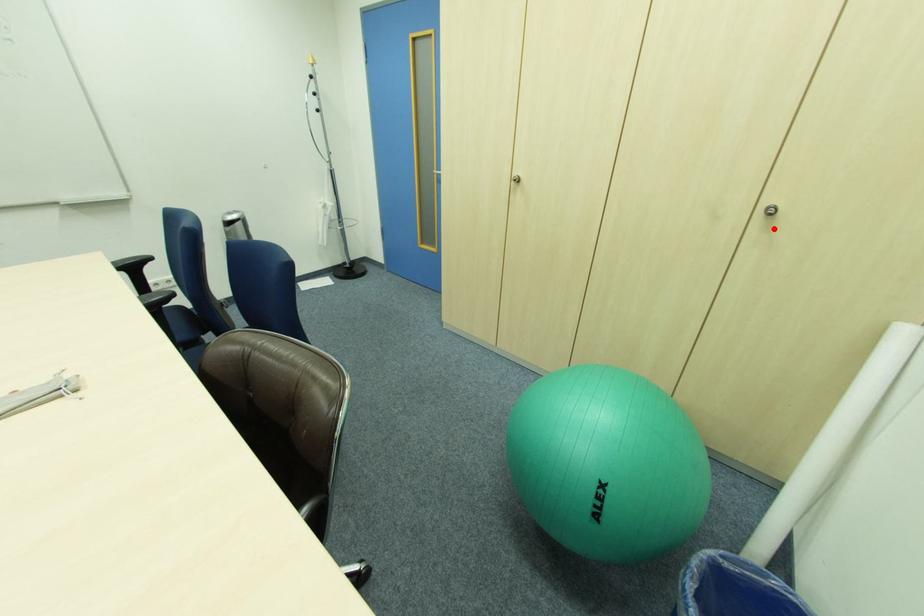
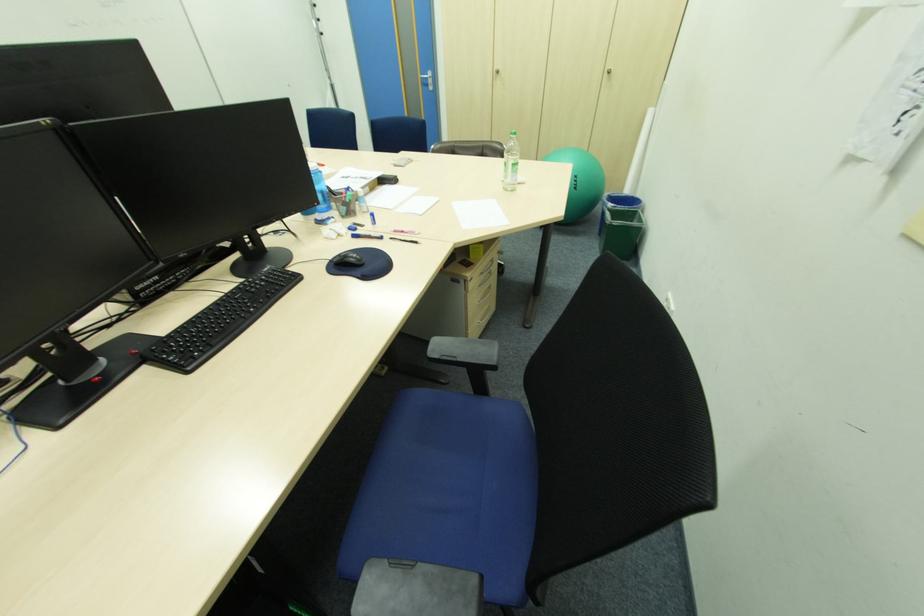
Where in the second image is the point corresponding to the highlighted location from the first image?

(615, 79)